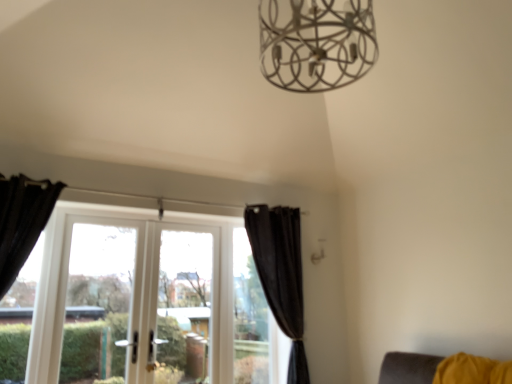
Question: From the image's perspective, is white glass window at center, the first window viewed from the left, located above or below black velvet curtain at center, which ranks as the first curtain in right-to-left order?

Choices:
 (A) below
 (B) above

Answer: (A)

Question: Visually, is white glass window at center, the second window positioned from the right, positioned to the left or to the right of black velvet curtain at center, which is counted as the second curtain, starting from the front?

Choices:
 (A) right
 (B) left

Answer: (B)

Question: Estimate the real-world distances between objects in this image. Which object is closer to the transparent glass window at center, the 1th window in the right-to-left sequence?

Choices:
 (A) yellow fabric chair at lower right
 (B) black velvet curtain at center, which is counted as the second curtain, starting from the front
 (C) black velvet curtain at left, the first curtain viewed from the left
 (D) white glass screen door at left
 (E) white glass window at center, the second window positioned from the right

Answer: (B)

Question: Estimate the real-world distances between objects in this image. Which object is closer to the black velvet curtain at left, acting as the 2th curtain starting from the right?

Choices:
 (A) white glass screen door at left
 (B) white glass window at center, the first window viewed from the left
 (C) yellow fabric chair at lower right
 (D) black velvet curtain at center, which appears as the 1th curtain when viewed from the back
 (E) transparent glass window at center, the 1th window in the right-to-left sequence

Answer: (A)